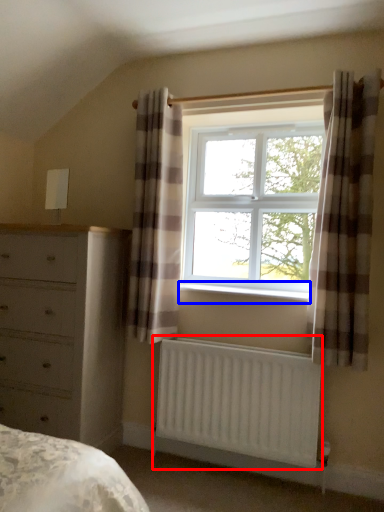
Question: Which object appears farthest to the camera in this image, radiator (highlighted by a red box) or window sill (highlighted by a blue box)?

Choices:
 (A) radiator
 (B) window sill

Answer: (B)